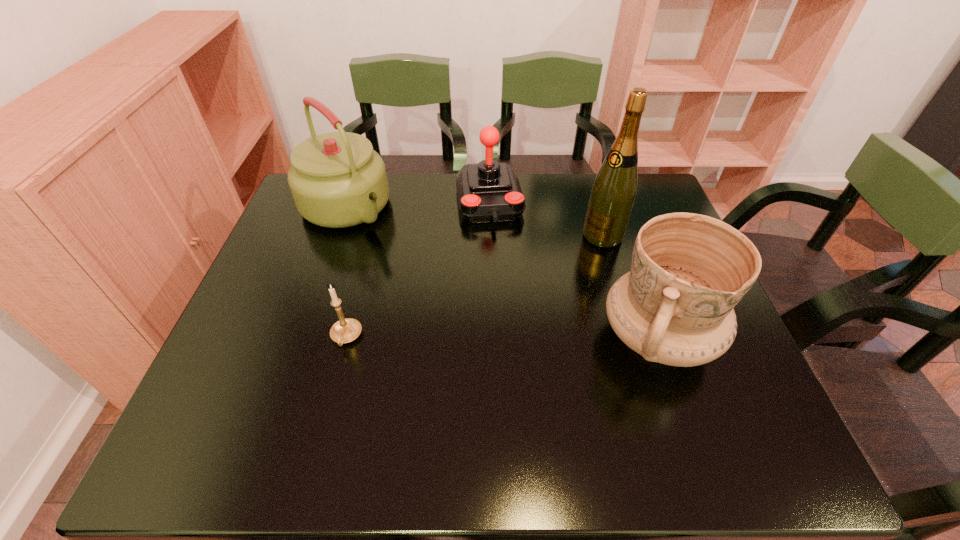
The width and height of the screenshot is (960, 540). Find the location of `free space between the pottery and the candle holder`. free space between the pottery and the candle holder is located at coordinates (502, 338).

Where is `vacant area between the kettle and the third object from left to right`? Image resolution: width=960 pixels, height=540 pixels. vacant area between the kettle and the third object from left to right is located at coordinates [x=418, y=205].

Locate an element on the screen. The width and height of the screenshot is (960, 540). free space that is in between the candle holder and the pottery is located at coordinates (502, 338).

Find the location of a particular element. vacant point located between the kettle and the third object from left to right is located at coordinates (418, 205).

Image resolution: width=960 pixels, height=540 pixels. Find the location of `free space between the third tallest object and the kettle`. free space between the third tallest object and the kettle is located at coordinates (502, 273).

Locate an element on the screen. unoccupied position between the candle holder and the kettle is located at coordinates (346, 273).

Find the location of a particular element. Image resolution: width=960 pixels, height=540 pixels. free spot between the third object from right to left and the kettle is located at coordinates (418, 205).

Find the location of `empty space between the third tallest object and the shortest object`. empty space between the third tallest object and the shortest object is located at coordinates (502, 338).

Where is `blank region between the kettle and the pottery`? The image size is (960, 540). blank region between the kettle and the pottery is located at coordinates (502, 273).

Where is `free space between the tallest object and the fourth tallest object`? This screenshot has width=960, height=540. free space between the tallest object and the fourth tallest object is located at coordinates (546, 219).